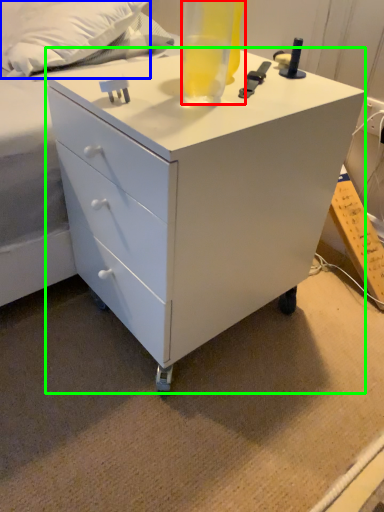
Question: Which object is positioned farthest from beverage (highlighted by a red box)? Select from pillow (highlighted by a blue box) and chest of drawers (highlighted by a green box).

Choices:
 (A) pillow
 (B) chest of drawers

Answer: (A)